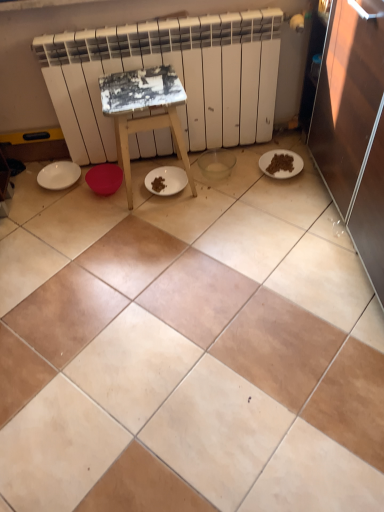
Question: Are white painted wood stool at center and white matte plate at left, the 2th paper plate viewed from the right, far apart?

Choices:
 (A) no
 (B) yes

Answer: (A)

Question: Is the depth of white painted wood stool at center greater than that of white matte plate at left, the 2th paper plate viewed from the right?

Choices:
 (A) yes
 (B) no

Answer: (B)

Question: From a real-world perspective, is white painted wood stool at center under white matte plate at left, which is counted as the 1th paper plate, starting from the left?

Choices:
 (A) yes
 (B) no

Answer: (B)

Question: Does white painted wood stool at center have a greater width compared to white matte plate at left, which is counted as the 1th paper plate, starting from the left?

Choices:
 (A) yes
 (B) no

Answer: (A)

Question: Is white painted wood stool at center at the left side of white matte plate at left, the 2th paper plate viewed from the right?

Choices:
 (A) yes
 (B) no

Answer: (B)

Question: Is white painted wood stool at center not inside white matte plate at left, which is counted as the 1th paper plate, starting from the left?

Choices:
 (A) yes
 (B) no

Answer: (A)

Question: Is white matte radiator at upper center in contact with beige ceramic tile at center?

Choices:
 (A) no
 (B) yes

Answer: (A)

Question: Considering the relative sizes of white matte radiator at upper center and beige ceramic tile at center in the image provided, is white matte radiator at upper center bigger than beige ceramic tile at center?

Choices:
 (A) no
 (B) yes

Answer: (B)

Question: Does white matte radiator at upper center have a lesser width compared to beige ceramic tile at center?

Choices:
 (A) yes
 (B) no

Answer: (A)

Question: Can you confirm if white matte radiator at upper center is smaller than beige ceramic tile at center?

Choices:
 (A) no
 (B) yes

Answer: (A)

Question: Is white matte radiator at upper center in front of beige ceramic tile at center?

Choices:
 (A) no
 (B) yes

Answer: (A)

Question: Considering the relative positions of white matte radiator at upper center and beige ceramic tile at center in the image provided, is white matte radiator at upper center to the right of beige ceramic tile at center from the viewer's perspective?

Choices:
 (A) no
 (B) yes

Answer: (A)

Question: Is white painted wood stool at center located outside white matte plate at lower right, which is the 2th paper plate from left to right?

Choices:
 (A) yes
 (B) no

Answer: (A)